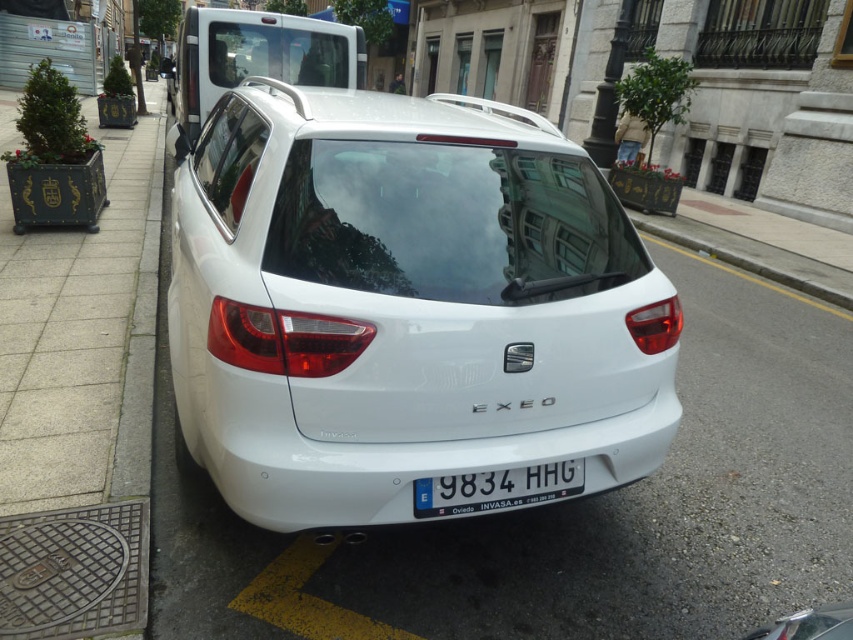
You are a delivery driver who needs to confirm the vehicle dimensions for a tight parking spot. The parking space can only accommodate vehicles up to the size of the white plastic license plate at center. Can the white matte hatchback at center fit into this space?

The white matte hatchback at center is larger in size than the white plastic license plate at center, so it cannot fit into the parking space designed for vehicles up to the license plate size.

You are standing on the sidewalk and see the white matte hatchback at center. If you want to walk to it, how many steps would you need to take if each step is about 2.5 feet?

The white matte hatchback at center is 6.56 feet away. Since each step is approximately 2.5 feet, you would need to take around 3 steps to reach it.